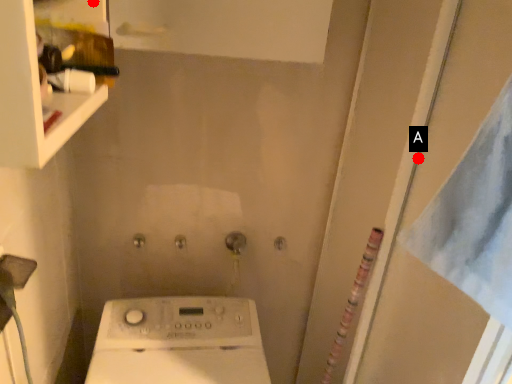
Question: Two points are circled on the image, labeled by A and B beside each circle. Which point is closer to the camera taking this photo?

Choices:
 (A) A is closer
 (B) B is closer

Answer: (B)